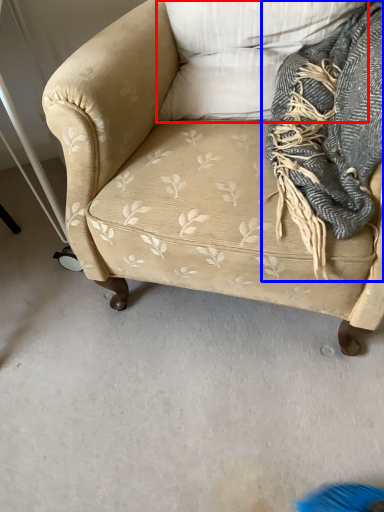
Question: Which object is further to the camera taking this photo, pillow (highlighted by a red box) or scarf (highlighted by a blue box)?

Choices:
 (A) pillow
 (B) scarf

Answer: (A)